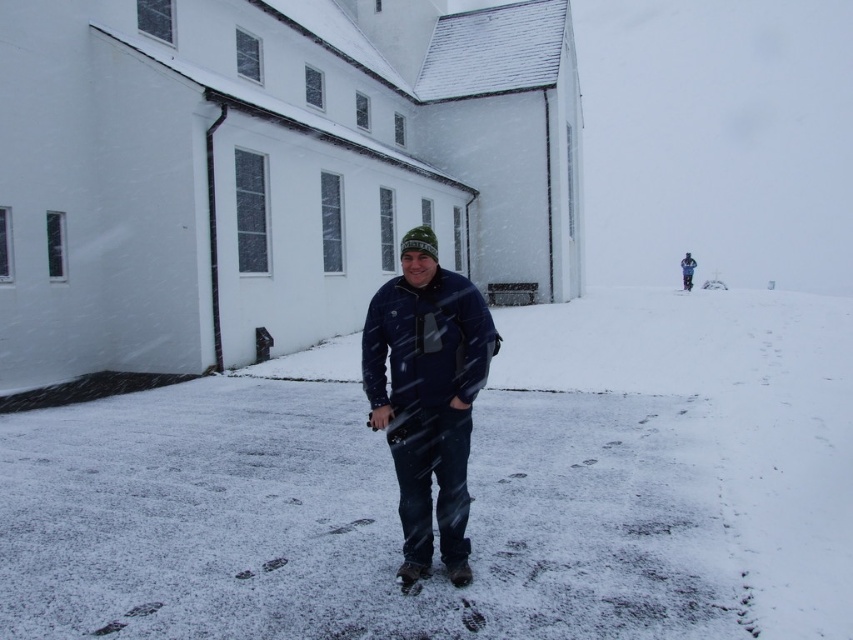
Question: Among these points, which one is nearest to the camera?

Choices:
 (A) 428,563
 (B) 62,497

Answer: (A)

Question: Is white powdery snow at center wider than dark blue jacket at center?

Choices:
 (A) yes
 (B) no

Answer: (A)

Question: Is white powdery snow at center positioned behind dark blue jacket at center?

Choices:
 (A) no
 (B) yes

Answer: (A)

Question: Is white powdery snow at center behind dark blue jacket at center?

Choices:
 (A) no
 (B) yes

Answer: (A)